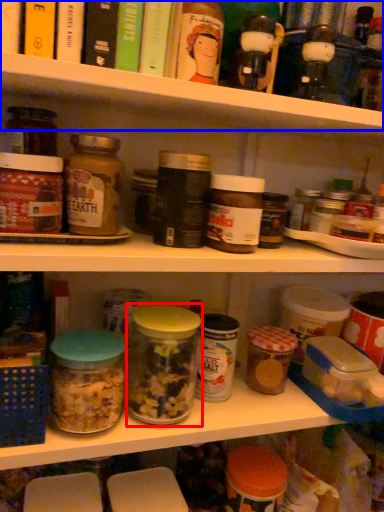
Question: Which of the following is the farthest to the observer, glass jar (highlighted by a red box) or shelf (highlighted by a blue box)?

Choices:
 (A) glass jar
 (B) shelf

Answer: (A)